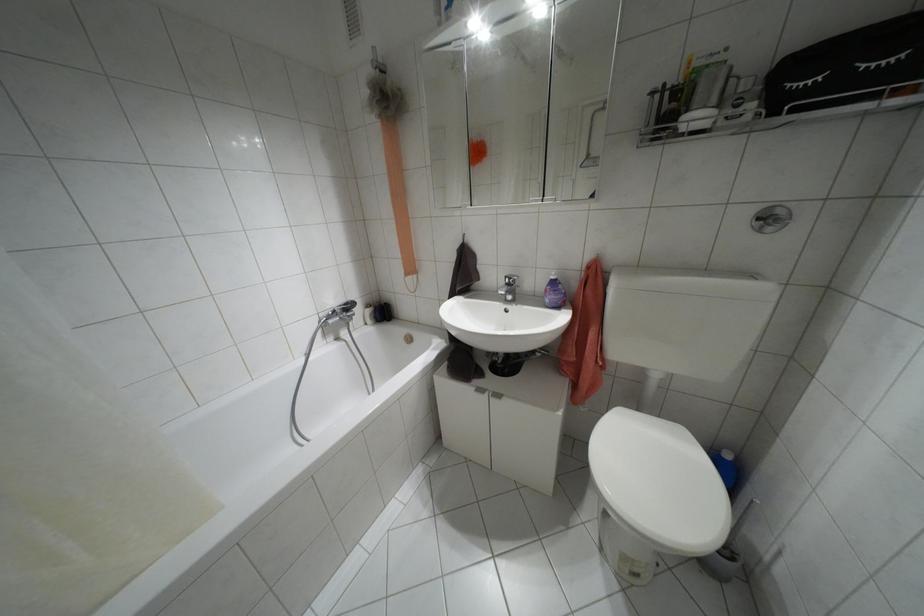
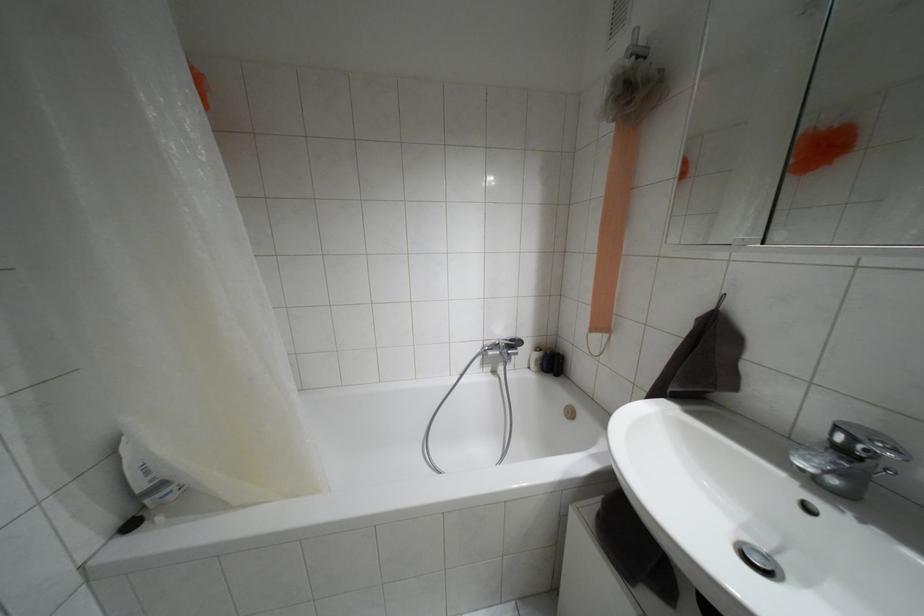
Question: The images are taken continuously from a first-person perspective. In which direction is your viewpoint rotating?

Choices:
 (A) Left
 (B) Right
 (C) Up
 (D) Down

Answer: (A)